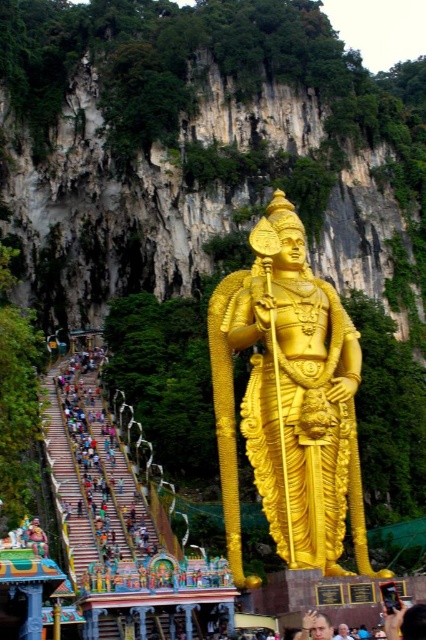
Who is more distant from viewer, (281, 209) or (336, 637)?

Positioned behind is point (281, 209).

Is the position of gold polished statue at center less distant than that of smooth skin face at lower center?

No, gold polished statue at center is further to the viewer.

The image size is (426, 640). In order to click on gold polished statue at center in this screenshot , I will do `click(288, 401)`.